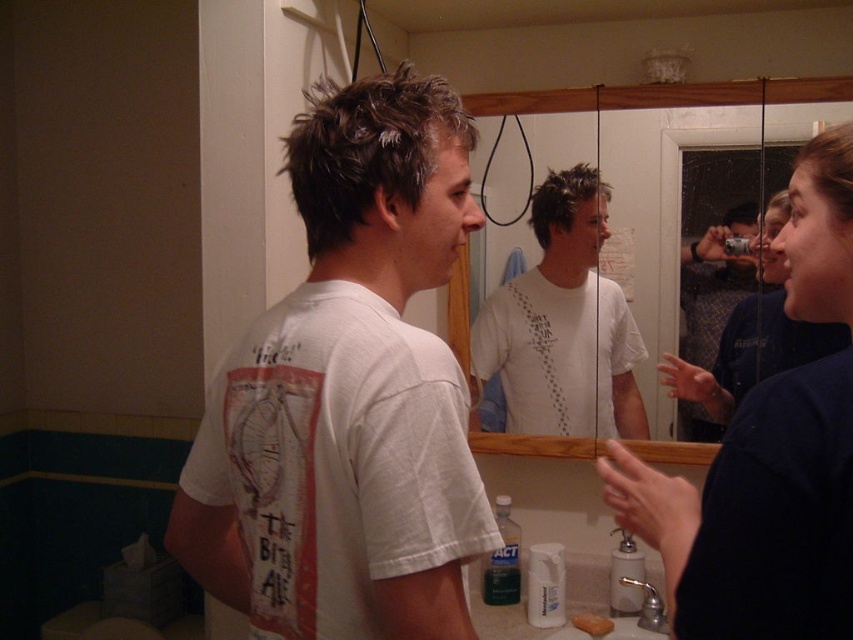
Who is higher up, dark blue fabric at upper right or white matte t-shirt at center?

white matte t-shirt at center is higher up.

Does point (819, 378) come closer to viewer compared to point (595, 328)?

Yes, point (819, 378) is in front of point (595, 328).

Identify the location of dark blue fabric at upper right. (756, 515).

You are a GUI agent. You are given a task and a screenshot of the screen. Output one action in this format:
    pyautogui.click(x=<x>, y=<y>)
    Task: Click on the white cotton t-shirt at center
    The width and height of the screenshot is (853, 640).
    Given the screenshot: What is the action you would take?
    pyautogui.click(x=347, y=394)

Does white cotton t-shirt at center have a lesser height compared to white matte t-shirt at center?

No, white cotton t-shirt at center is not shorter than white matte t-shirt at center.

Where is `white cotton t-shirt at center`? This screenshot has width=853, height=640. white cotton t-shirt at center is located at coordinates (347, 394).

This screenshot has height=640, width=853. What are the coordinates of `white cotton t-shirt at center` in the screenshot? It's located at (347, 394).

Does point (300, 186) come farther from viewer compared to point (664, 460)?

No, (300, 186) is in front of (664, 460).

I want to click on white cotton t-shirt at center, so click(x=347, y=394).